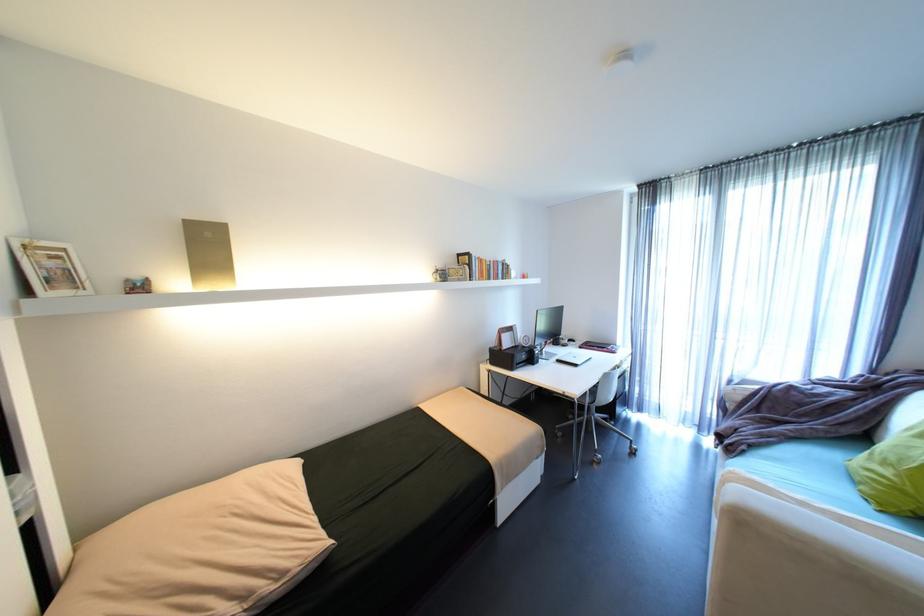
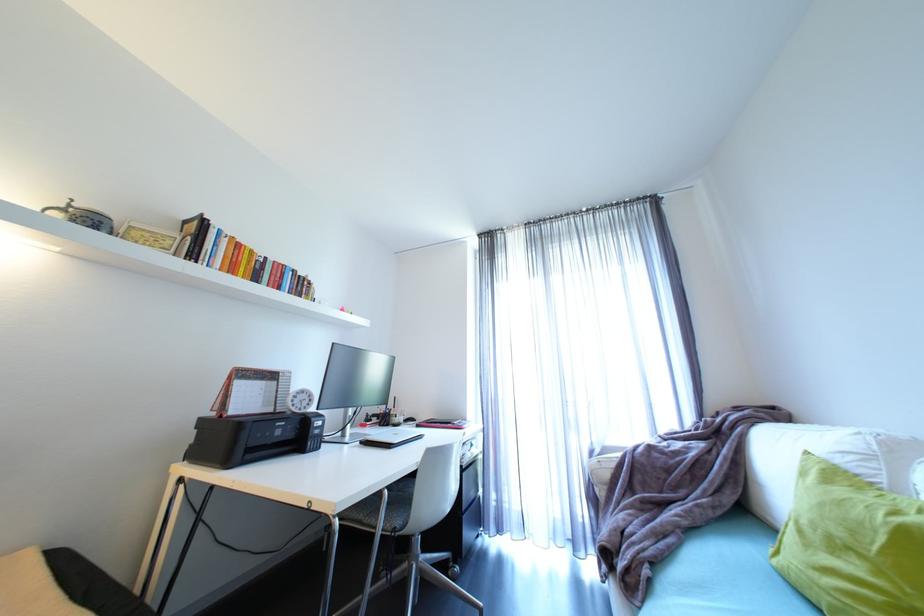
Locate, in the second image, the point that corresponds to the point at 612,347 in the first image.

(457, 424)